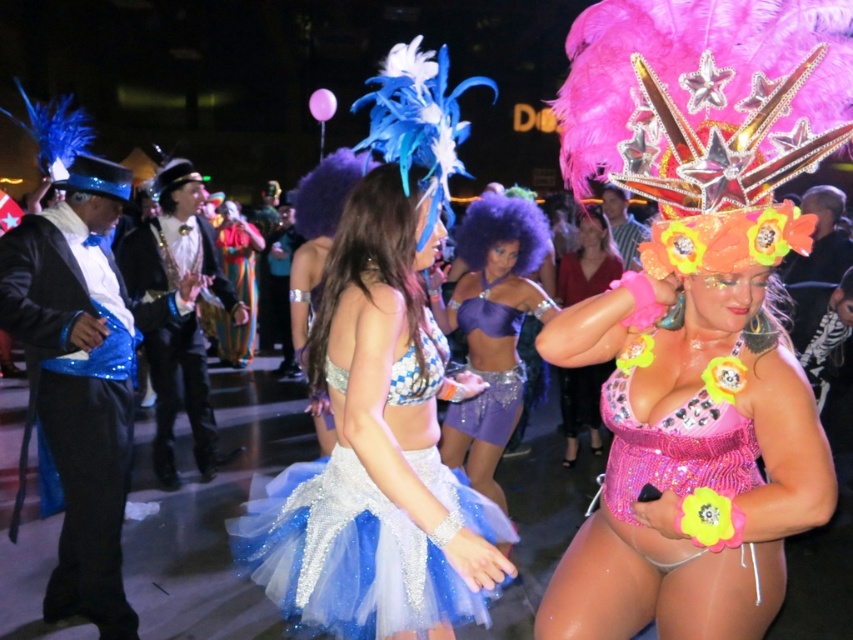
Question: Based on their relative distances, which object is nearer to the shiny purple bikini top at center?

Choices:
 (A) glittery blue tutu at center
 (B) pink sequined bikini at right
 (C) shiny silver bikini at center
 (D) purple sequined dress at center

Answer: (D)

Question: Is glittery blue tutu at center closer to camera compared to shiny silver bikini at center?

Choices:
 (A) no
 (B) yes

Answer: (B)

Question: Is pink sequined bikini at right wider than shiny silver bikini at center?

Choices:
 (A) yes
 (B) no

Answer: (B)

Question: Estimate the real-world distances between objects in this image. Which object is closer to the glittery blue tutu at center?

Choices:
 (A) shiny silver bikini at center
 (B) pink sequined bikini at right

Answer: (B)

Question: Can you confirm if glittery blue tutu at center is bigger than shiny silver bikini at center?

Choices:
 (A) yes
 (B) no

Answer: (B)

Question: Which object is the farthest from the pink sequined bikini at right?

Choices:
 (A) purple sequined dress at center
 (B) shiny silver bikini at center
 (C) shiny purple bikini top at center

Answer: (B)